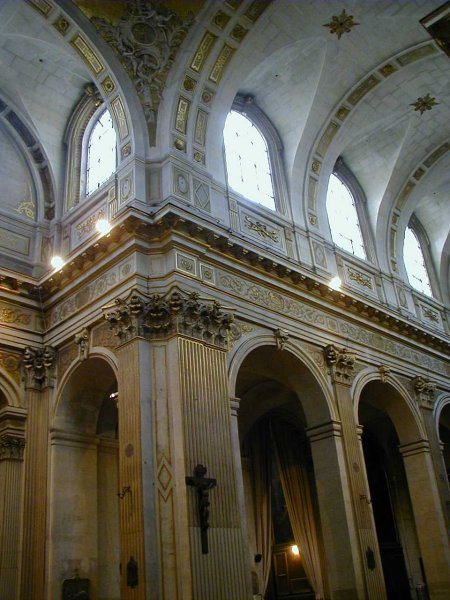
I want to click on archway, so click(x=279, y=354), click(x=383, y=390), click(x=87, y=376).